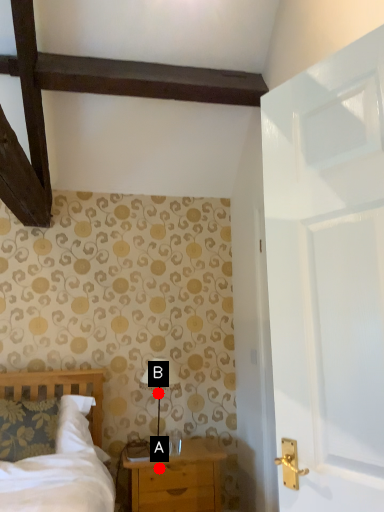
Question: Two points are circled on the image, labeled by A and B beside each circle. Which point is closer to the camera?

Choices:
 (A) A is closer
 (B) B is closer

Answer: (A)